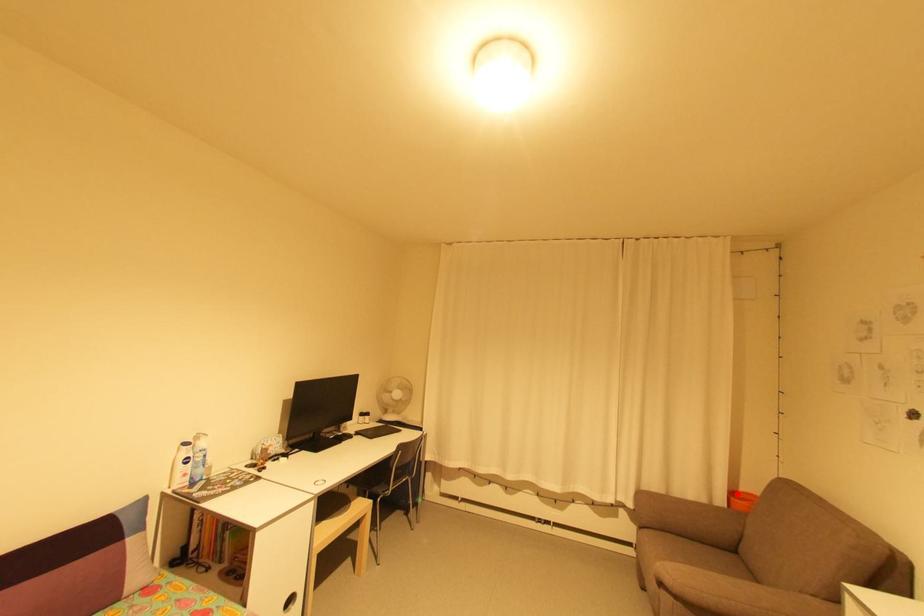
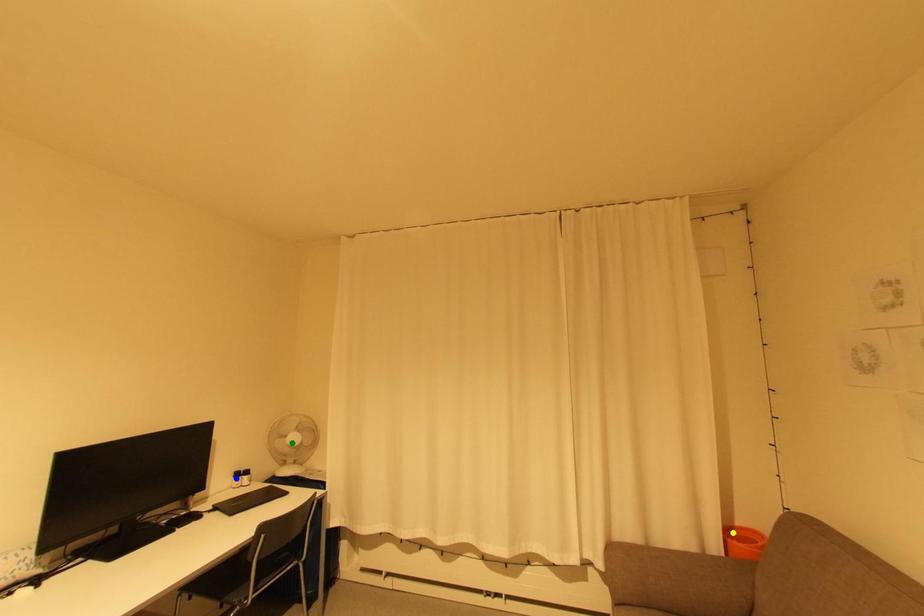
Question: I am providing you with two images of the same scene from different viewpoints. A red point is marked on the first image. You are given multiple points on the second image. Which point in image 2 is actually the same real-world point as the red point in image 1?

Choices:
 (A) blue point
 (B) yellow point
 (C) green point

Answer: (B)